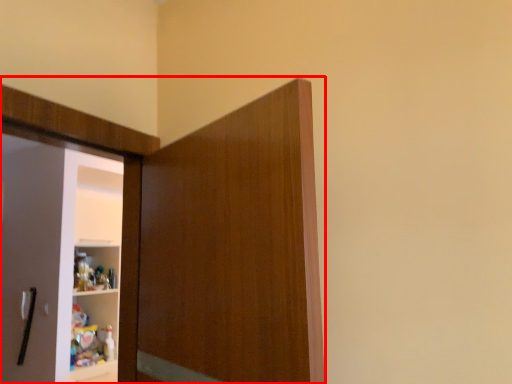
Question: In this image, where is cupboard (annotated by the red box) located relative to door handle?

Choices:
 (A) left
 (B) right

Answer: (B)